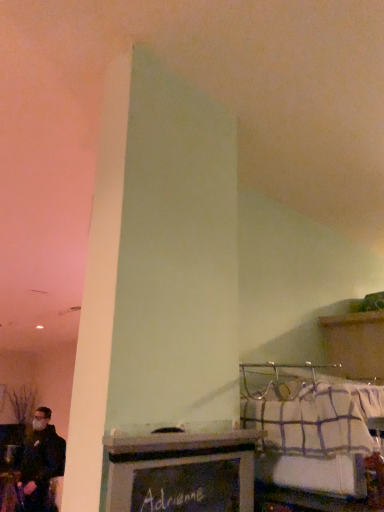
Question: Looking at their shapes, would you say white checkered fabric at lower right is wider or thinner than metallic silver tray at center?

Choices:
 (A) wide
 (B) thin

Answer: (A)

Question: In terms of height, does white checkered fabric at lower right look taller or shorter compared to metallic silver tray at center?

Choices:
 (A) short
 (B) tall

Answer: (A)

Question: Relative to metallic silver tray at center, is white checkered fabric at lower right in front or behind?

Choices:
 (A) front
 (B) behind

Answer: (B)

Question: In the image, is metallic silver tray at center on the left side or the right side of white checkered fabric at lower right?

Choices:
 (A) left
 (B) right

Answer: (A)

Question: Considering their positions, is metallic silver tray at center located in front of or behind white checkered fabric at lower right?

Choices:
 (A) behind
 (B) front

Answer: (B)

Question: From their relative heights in the image, would you say metallic silver tray at center is taller or shorter than white checkered fabric at lower right?

Choices:
 (A) tall
 (B) short

Answer: (A)

Question: Is point (172, 495) positioned closer to the camera than point (316, 384)?

Choices:
 (A) closer
 (B) farther

Answer: (A)